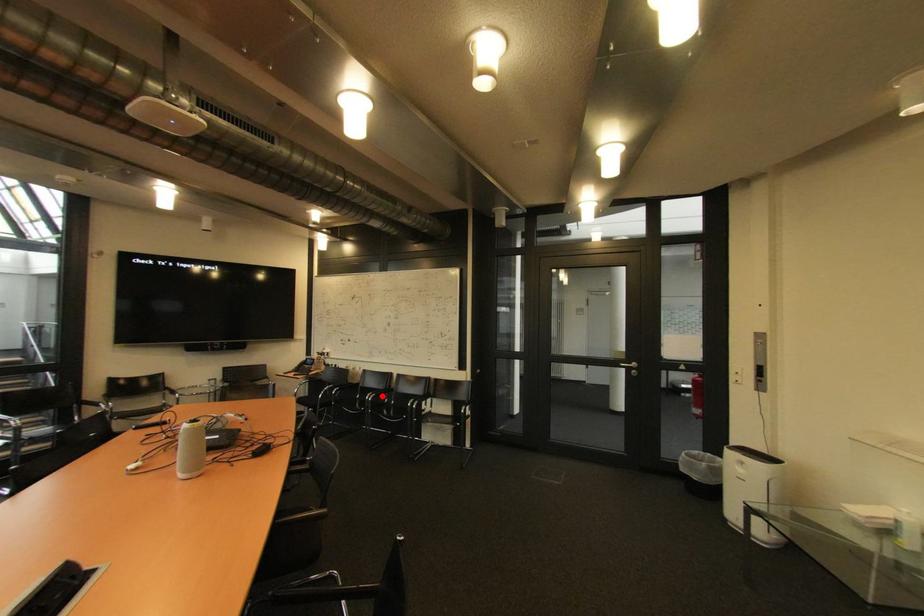
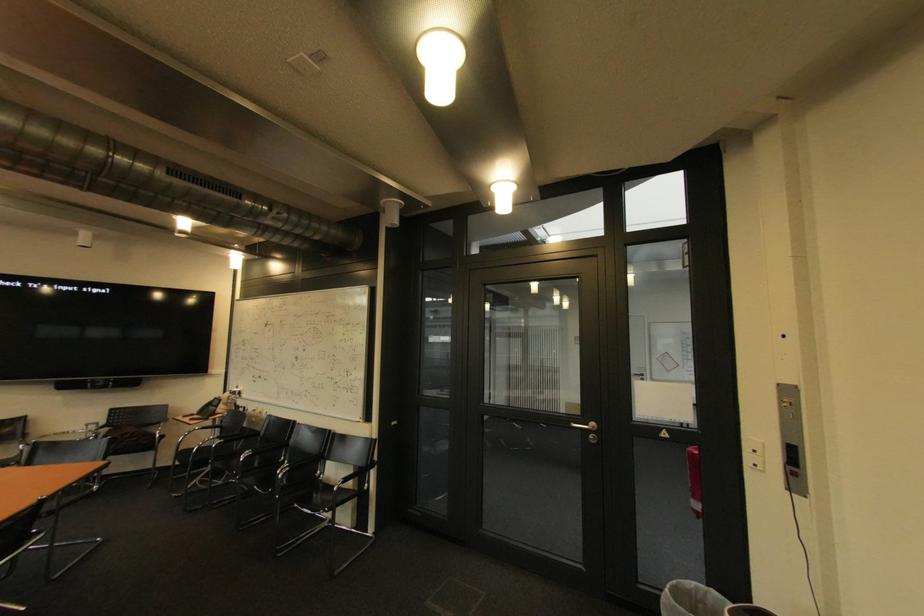
Question: I am providing you with two images of the same scene from different viewpoints. Image1 has a red point marked. In image2, the corresponding 3D location appears at what relative position? Reply with the corresponding letter.

Choices:
 (A) Closer
 (B) Farther

Answer: (A)